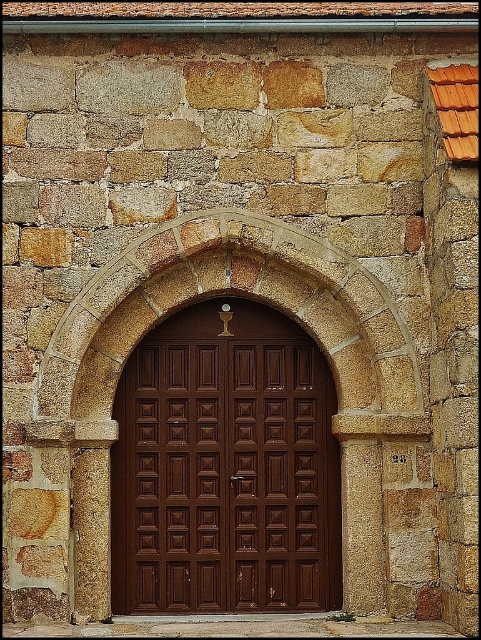
You are an architect examining the stone building. You need to determine if a new door of the same design as the brown wooden door at center can be installed in the stone textured archway at center. Can the door fit through the archway based on their widths?

The brown wooden door at center has a width less than the stone textured archway at center, so yes, the new door of the same design can fit through the archway.

You are an architect assessing the proportions of the building. Based on the image, which object has a smaller height between the brown wooden door at center and the stone textured archway at center?

The brown wooden door at center has a lesser height compared to the stone textured archway at center.

You are standing in front of the stone building and want to locate the brown wooden door at center. According to the coordinates provided, where exactly is the door positioned relative to the archway?

The brown wooden door at center is located at point coordinates 0.733 on the x axis and 0.468 on the y axis, meaning it is positioned slightly to the right and below the center of the archway.